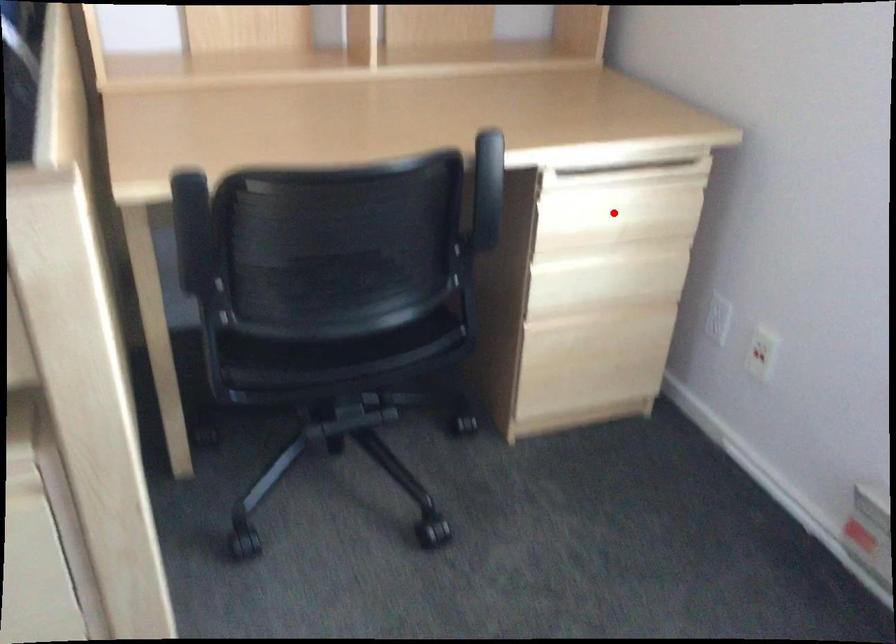
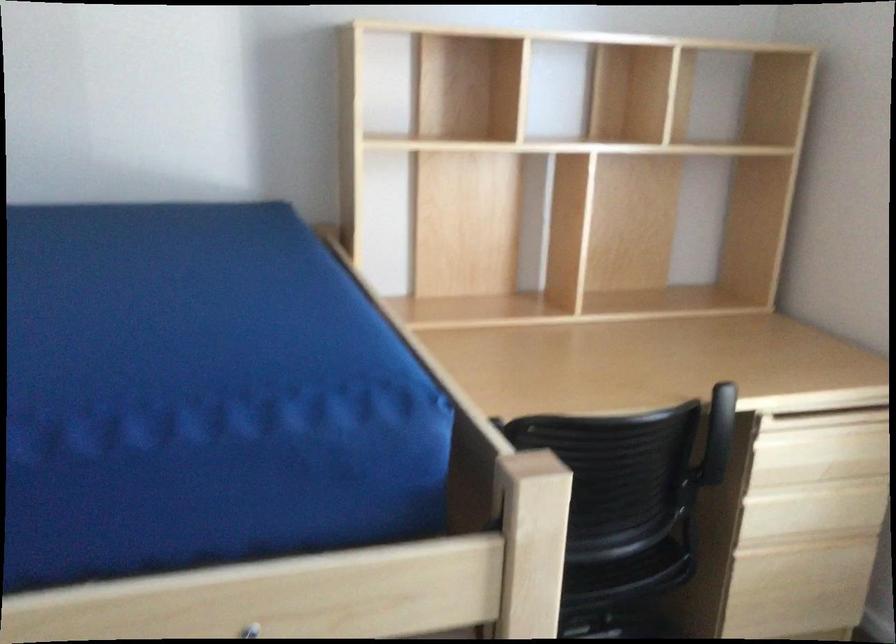
Find the pixel in the second image that matches the highlighted location in the first image.

(819, 450)